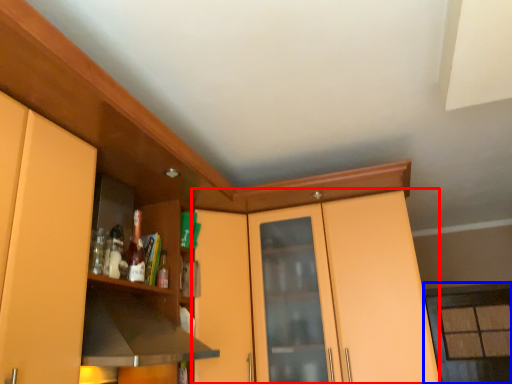
Question: Among these objects, which one is farthest to the camera, dresser (highlighted by a red box) or window (highlighted by a blue box)?

Choices:
 (A) dresser
 (B) window

Answer: (B)